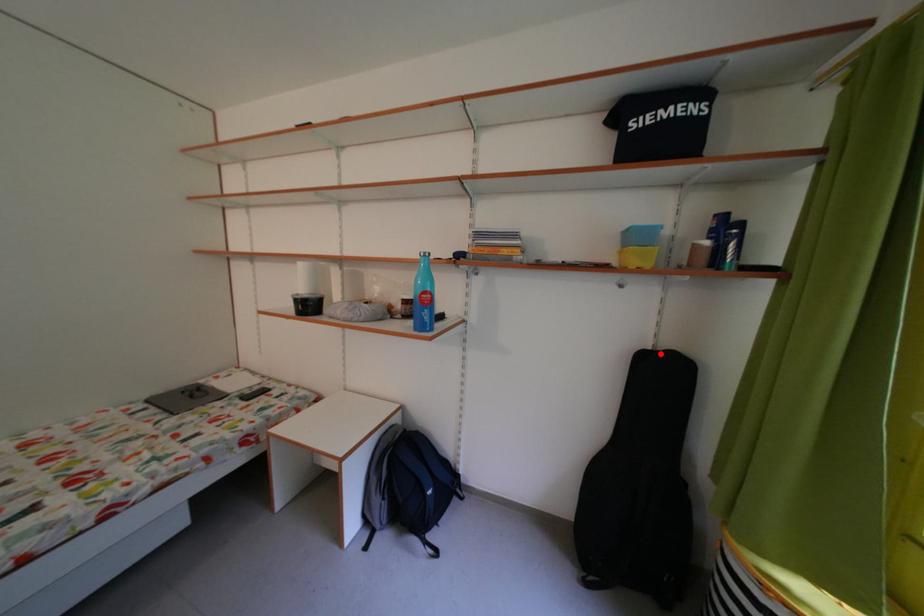
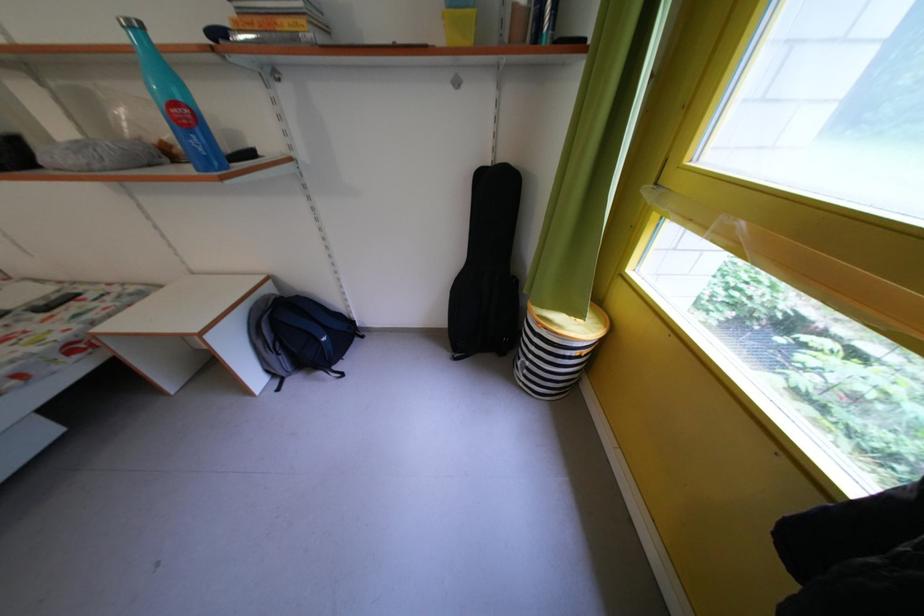
Question: I am providing you with two images of the same scene from different viewpoints. A red point is shown in image1. For the corresponding object point in image2, is it positioned nearer or farther from the camera?

Choices:
 (A) Nearer
 (B) Farther

Answer: (A)